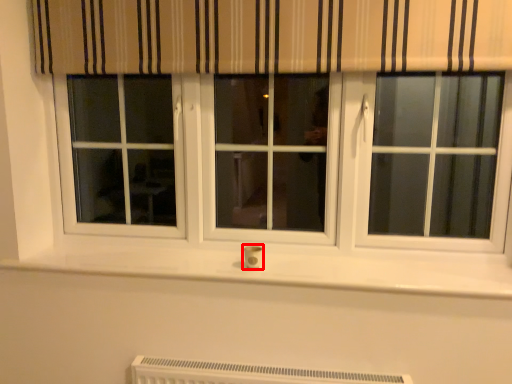
Question: From the image's perspective, considering the relative positions of electric outlet (annotated by the red box) and heater in the image provided, where is electric outlet (annotated by the red box) located with respect to the staircase?

Choices:
 (A) below
 (B) above

Answer: (B)